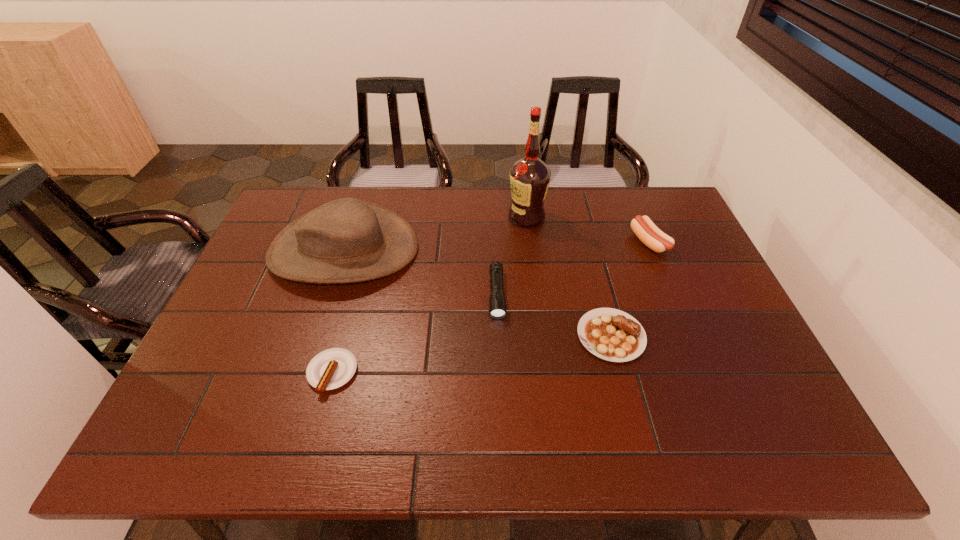
The height and width of the screenshot is (540, 960). I want to click on the closest object to the farther sausage, so click(x=610, y=334).

Select which object appears as the fifth closest to the shorter sausage. Please provide its 2D coordinates. Your answer should be formatted as a tuple, i.e. [(x, y)], where the tuple contains the x and y coordinates of a point satisfying the conditions above.

[(648, 233)]

In order to click on free space that satisfies the following two spatial constraints: 1. on the back side of the steak; 2. on the label of the third object from right to left in this screenshot , I will do `click(580, 217)`.